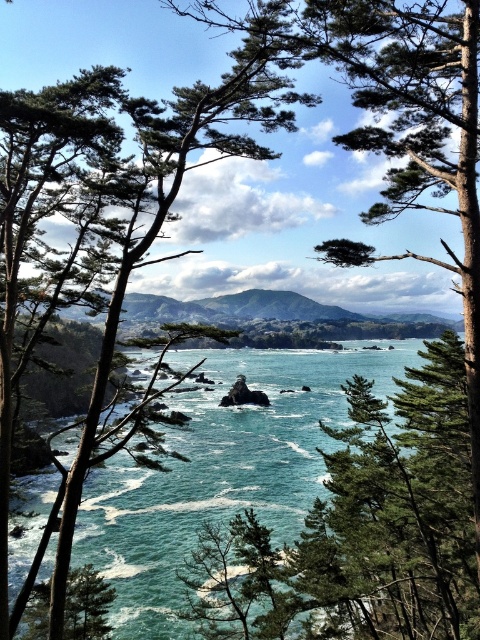
Which is below, teal glossy water at center or green leafy tree at center?

teal glossy water at center

Is teal glossy water at center bigger than green leafy tree at center?

→ Actually, teal glossy water at center might be smaller than green leafy tree at center.

Is point (312, 419) behind point (14, 104)?

Yes, point (312, 419) is farther from viewer.

This screenshot has width=480, height=640. Identify the location of teal glossy water at center. (220, 472).